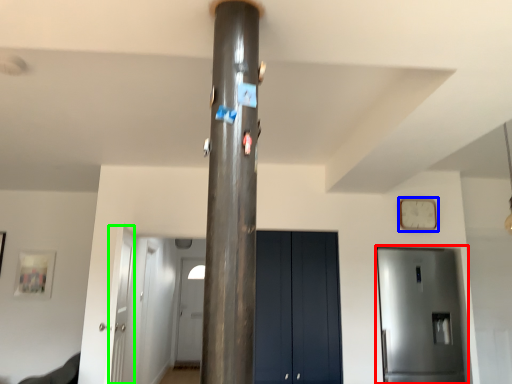
Question: Which object is the closest to the door (highlighted by a red box)? Choose among these: clock (highlighted by a blue box) or door (highlighted by a green box).

Choices:
 (A) clock
 (B) door

Answer: (A)